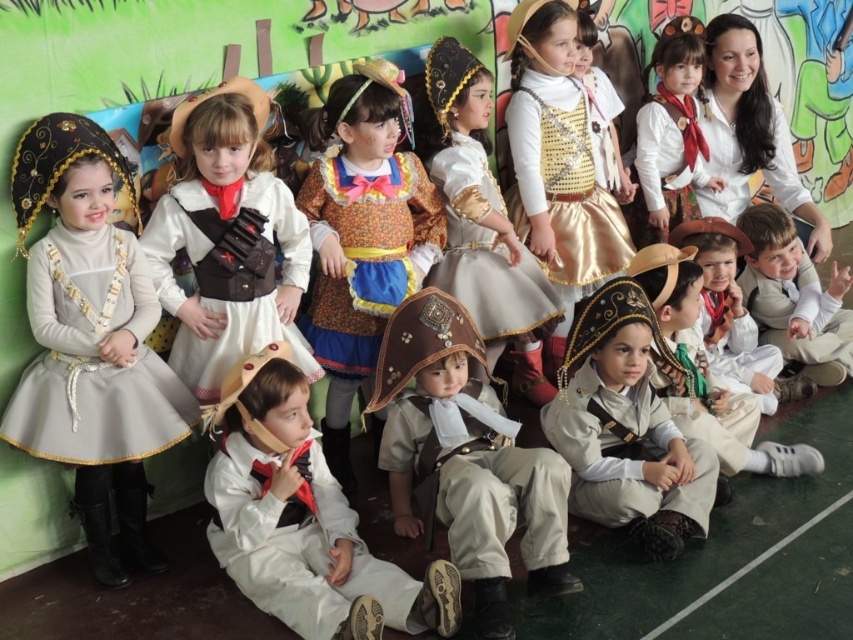
Question: Is brown leather hat at center to the left of matte white dress at upper right from the viewer's perspective?

Choices:
 (A) no
 (B) yes

Answer: (B)

Question: Which point is farther to the camera?

Choices:
 (A) light beige fabric hat at lower center
 (B) matte brown dress at center
 (C) matte beige vest at center
 (D) matte gray dress at left

Answer: (C)

Question: Which is nearer to the matte beige vest at center?

Choices:
 (A) white cotton blouse at upper right
 (B) brown leather hat at center
 (C) matte white dress at upper right

Answer: (A)

Question: Estimate the real-world distances between objects in this image. Which object is farther from the matte brown vest at center?

Choices:
 (A) light beige fabric hat at lower center
 (B) matte gray dress at left
 (C) white satin pirate costume at center

Answer: (A)

Question: Does matte gray dress at left have a lesser width compared to matte brown dress at center?

Choices:
 (A) yes
 (B) no

Answer: (B)

Question: From the image, what is the correct spatial relationship of light beige fabric hat at lower center in relation to white cotton shirt at lower right?

Choices:
 (A) below
 (B) above

Answer: (A)